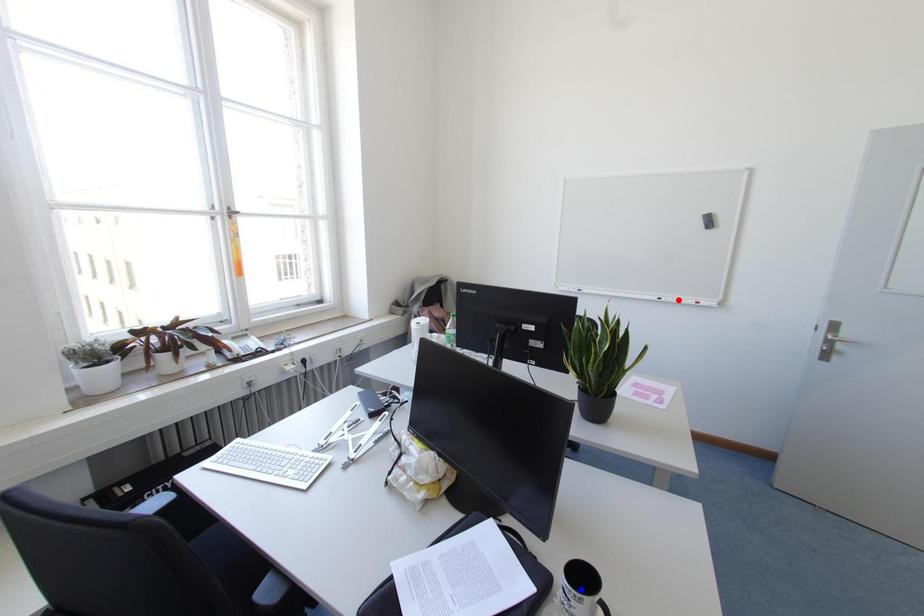
Question: Two points are marked on the image. Which point is closer to the camera?

Choices:
 (A) Blue point is closer.
 (B) Red point is closer.

Answer: (A)